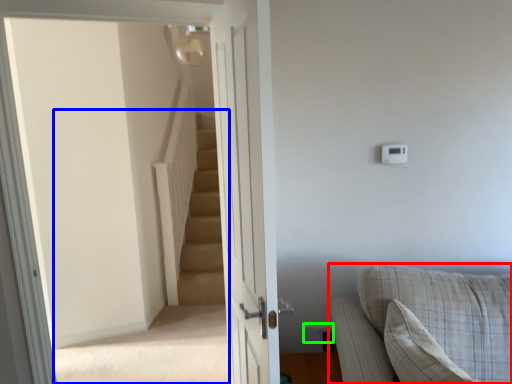
Question: Estimate the real-world distances between objects in this image. Which object is closer to studio couch (highlighted by a red box), stairwell (highlighted by a blue box) or electric outlet (highlighted by a green box)?

Choices:
 (A) stairwell
 (B) electric outlet

Answer: (B)